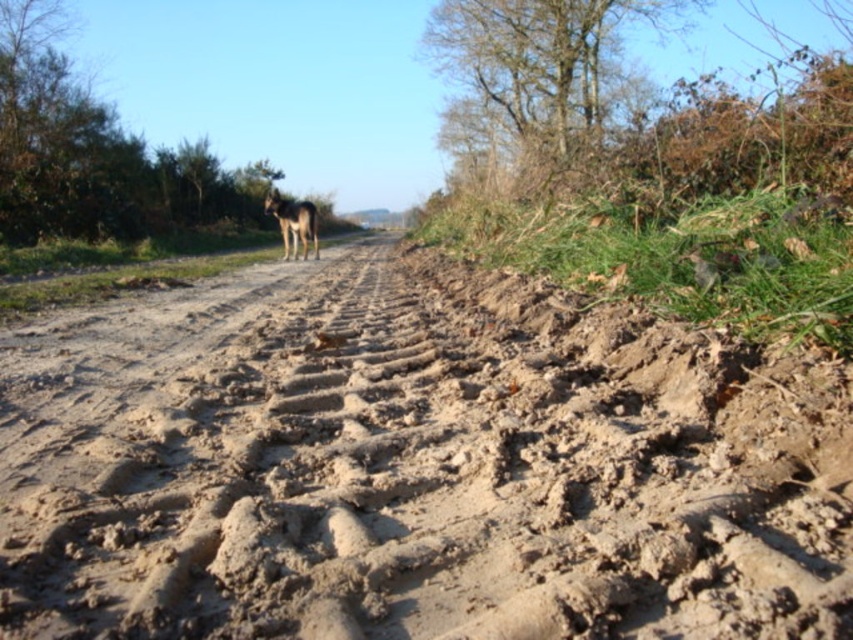
You are standing on the muddy dirt road and want to walk to the background. Which point, point (x=140, y=550) or point (x=264, y=209), will you reach first?

Point (x=140, y=550) is closer to the viewer than point (x=264, y=209), so you will reach point (x=140, y=550) first.

You are a hiker trying to cross the dry mud track at center. There is a brown fur dog at center blocking your path. Can you step over the dog without stepping onto the track?

The dry mud track at center is lower than the brown fur dog at center, so stepping over the dog would require going higher than the track, meaning you would have to step onto the track to get over the dog.